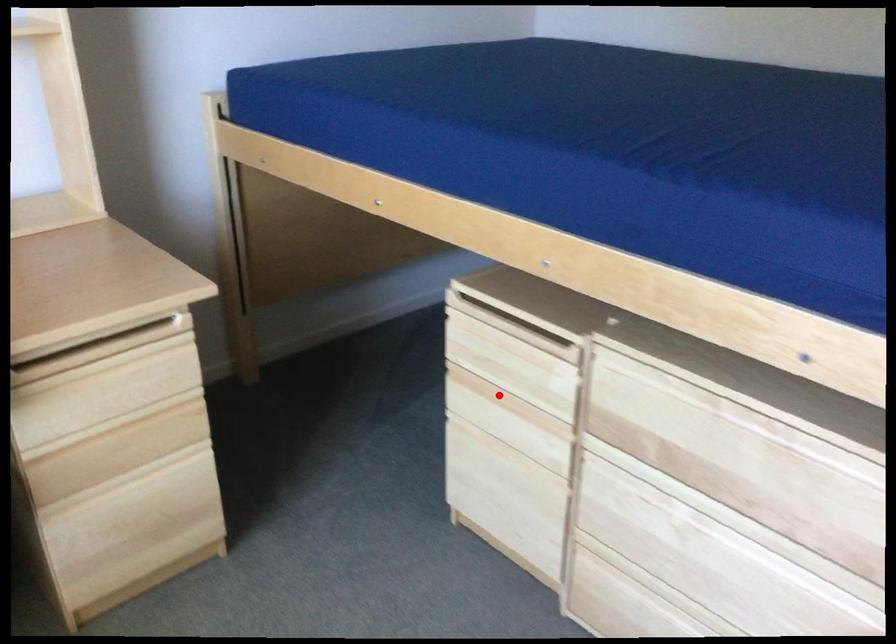
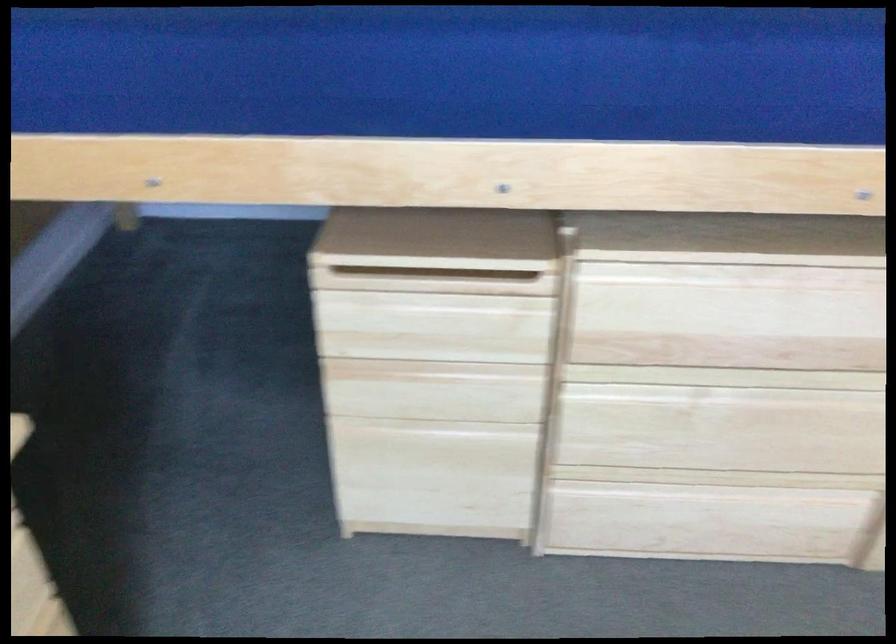
Question: A red point is marked in image1. In image2, is the corresponding 3D point closer to the camera or farther? Reply with the corresponding letter.

Choices:
 (A) The corresponding 3D point is closer.
 (B) The corresponding 3D point is farther.

Answer: (A)